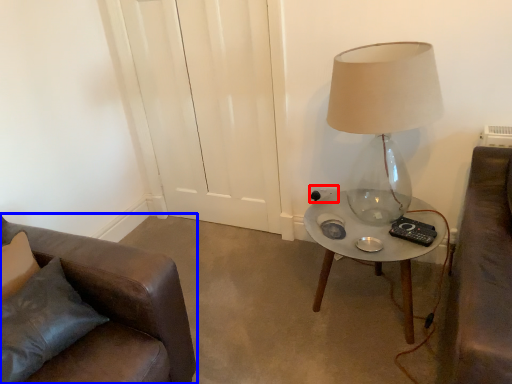
Question: Which object is further to the camera taking this photo, electric outlet (highlighted by a red box) or chair (highlighted by a blue box)?

Choices:
 (A) electric outlet
 (B) chair

Answer: (A)